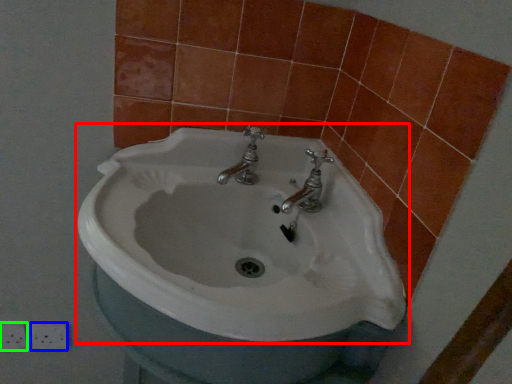
Question: Which is nearer to the sink (highlighted by a red box)? ceramic tile (highlighted by a blue box) or ceramic tile (highlighted by a green box).

Choices:
 (A) ceramic tile
 (B) ceramic tile

Answer: (A)